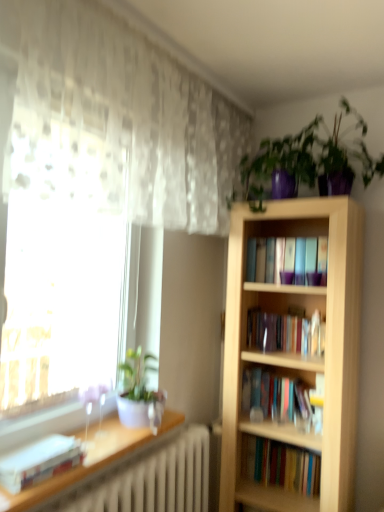
Question: Could white glossy pot at left, marked as the 2th houseplant in a top-to-bottom arrangement, be considered to be inside white glossy shelf at lower left?

Choices:
 (A) no
 (B) yes

Answer: (A)

Question: From a real-world perspective, does white glossy shelf at lower left sit lower than white glossy pot at left, marked as the 1th houseplant in a bottom-to-top arrangement?

Choices:
 (A) no
 (B) yes

Answer: (B)

Question: Does white glossy shelf at lower left come in front of white glossy pot at left, which appears as the first houseplant when viewed from the left?

Choices:
 (A) no
 (B) yes

Answer: (B)

Question: Is white glossy shelf at lower left smaller than white glossy pot at left, which appears as the first houseplant when viewed from the left?

Choices:
 (A) no
 (B) yes

Answer: (B)

Question: Does white glossy shelf at lower left have a greater width compared to white glossy pot at left, marked as the 1th houseplant in a bottom-to-top arrangement?

Choices:
 (A) no
 (B) yes

Answer: (B)

Question: From a real-world perspective, is white glossy shelf at lower left physically above white glossy pot at left, marked as the 2th houseplant in a right-to-left arrangement?

Choices:
 (A) yes
 (B) no

Answer: (B)

Question: Is white glossy shelf at lower left outside light wood bookcase at right?

Choices:
 (A) no
 (B) yes

Answer: (B)

Question: Does white glossy shelf at lower left appear on the left side of light wood bookcase at right?

Choices:
 (A) no
 (B) yes

Answer: (B)

Question: Is white glossy shelf at lower left turned away from light wood bookcase at right?

Choices:
 (A) yes
 (B) no

Answer: (B)

Question: Is white glossy shelf at lower left directly adjacent to light wood bookcase at right?

Choices:
 (A) no
 (B) yes

Answer: (A)

Question: Considering the relative positions of white glossy shelf at lower left and light wood bookcase at right in the image provided, is white glossy shelf at lower left behind light wood bookcase at right?

Choices:
 (A) yes
 (B) no

Answer: (B)

Question: Could you tell me if white glossy shelf at lower left is facing light wood bookcase at right?

Choices:
 (A) no
 (B) yes

Answer: (A)

Question: Can you confirm if shiny purple pot at upper right, the first houseplant viewed from the top, is shorter than white glossy pot at left, marked as the 2th houseplant in a top-to-bottom arrangement?

Choices:
 (A) no
 (B) yes

Answer: (A)